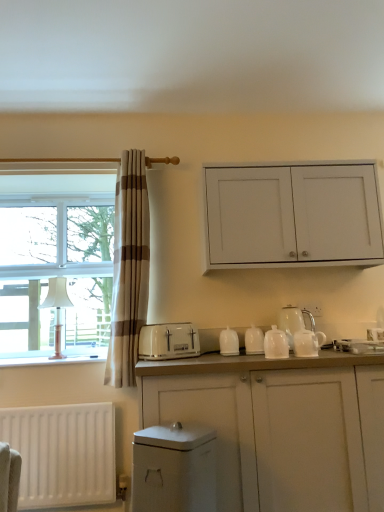
Question: Is white fabric lampshade at left outside of white plastic toaster at center?

Choices:
 (A) no
 (B) yes

Answer: (B)

Question: Does white fabric lampshade at left turn towards white plastic toaster at center?

Choices:
 (A) no
 (B) yes

Answer: (A)

Question: From the image's perspective, is white fabric lampshade at left above white plastic toaster at center?

Choices:
 (A) no
 (B) yes

Answer: (B)

Question: Is white fabric lampshade at left wider than white plastic toaster at center?

Choices:
 (A) no
 (B) yes

Answer: (A)

Question: From a real-world perspective, is white fabric lampshade at left positioned under white plastic toaster at center based on gravity?

Choices:
 (A) yes
 (B) no

Answer: (B)

Question: Is white fabric lampshade at left closer to camera compared to white plastic toaster at center?

Choices:
 (A) no
 (B) yes

Answer: (A)

Question: Can you confirm if white glossy teapot at center, the second tableware when ordered from front to back, is taller than white glossy dishwasher at lower center?

Choices:
 (A) yes
 (B) no

Answer: (B)

Question: From a real-world perspective, is white glossy teapot at center, the second tableware from the back, positioned under white glossy dishwasher at lower center based on gravity?

Choices:
 (A) no
 (B) yes

Answer: (A)

Question: Can you confirm if white glossy teapot at center, the second tableware when ordered from front to back, is positioned to the left of white glossy dishwasher at lower center?

Choices:
 (A) yes
 (B) no

Answer: (B)

Question: Considering the relative sizes of white glossy teapot at center, the second tableware when ordered from front to back, and white glossy dishwasher at lower center in the image provided, is white glossy teapot at center, the second tableware when ordered from front to back, shorter than white glossy dishwasher at lower center?

Choices:
 (A) no
 (B) yes

Answer: (B)

Question: Does white glossy teapot at center, the second tableware when ordered from front to back, have a greater width compared to white glossy dishwasher at lower center?

Choices:
 (A) no
 (B) yes

Answer: (A)

Question: Is white glossy teapot at center, the second tableware when ordered from front to back, facing away from white glossy dishwasher at lower center?

Choices:
 (A) no
 (B) yes

Answer: (A)

Question: Is white glossy teapot at center, which appears as the first tableware when viewed from the front, next to white matte cabinet at upper right, which appears as the 2th cabinetry when ordered from the bottom, and touching it?

Choices:
 (A) no
 (B) yes

Answer: (A)